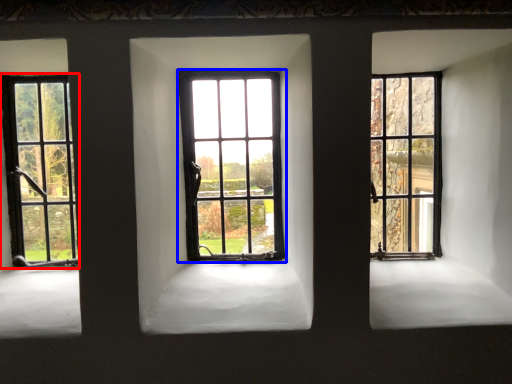
Question: Which object is further to the camera taking this photo, window (highlighted by a red box) or window (highlighted by a blue box)?

Choices:
 (A) window
 (B) window

Answer: (A)